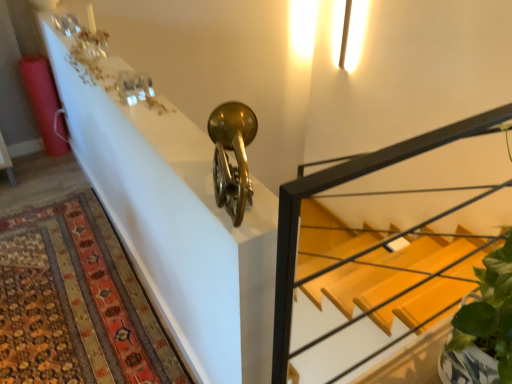
Question: From a real-world perspective, is wooden stairs at center positioned above or below metallic gold trumpet at upper center?

Choices:
 (A) above
 (B) below

Answer: (B)

Question: Looking at the image, does wooden stairs at center seem bigger or smaller compared to metallic gold trumpet at upper center?

Choices:
 (A) small
 (B) big

Answer: (B)

Question: Estimate the real-world distances between objects in this image. Which object is farther from the carpeted rug at lower left?

Choices:
 (A) wooden stairs at center
 (B) metallic gold trumpet at upper center

Answer: (A)

Question: Estimate the real-world distances between objects in this image. Which object is farther from the carpeted rug at lower left?

Choices:
 (A) metallic gold trumpet at upper center
 (B) wooden stairs at center

Answer: (B)